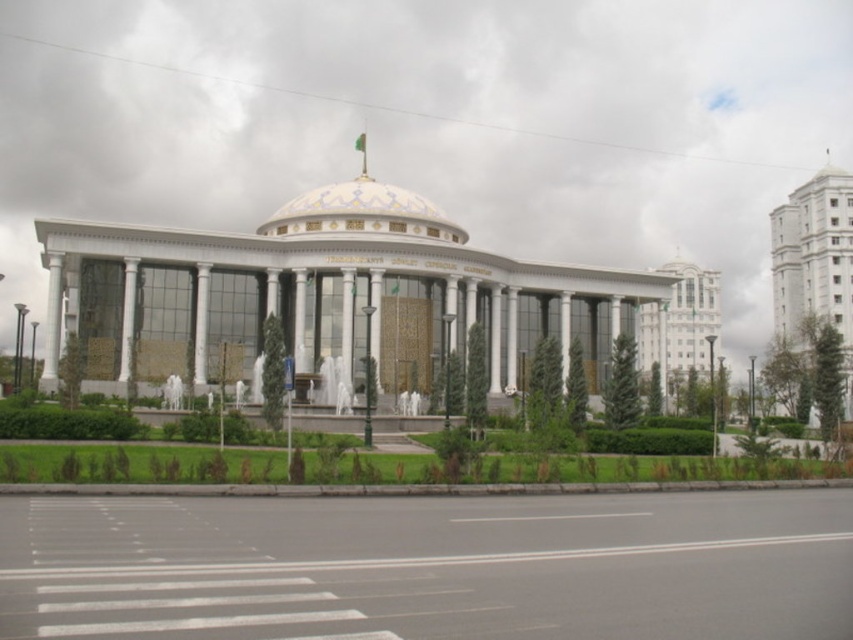
You are standing at the point marked by the coordinates point (363, 209) in the image. What structure are you directly facing?

The point (363, 209) indicates the white glossy dome at center, so you are directly facing the white glossy dome at center.

You are a landscape architect designing a new pathway that needs to pass between the white marble palace at center and the white glossy dome at center. The pathway must be at least 10 meters wide to accommodate large ceremonial events. Can the existing space between these two structures accommodate this requirement?

The white marble palace at center and the white glossy dome at center are 11.34 meters apart from each other, which is wider than the required 10 meters. Therefore, the pathway can be constructed between them to meet the event requirements.